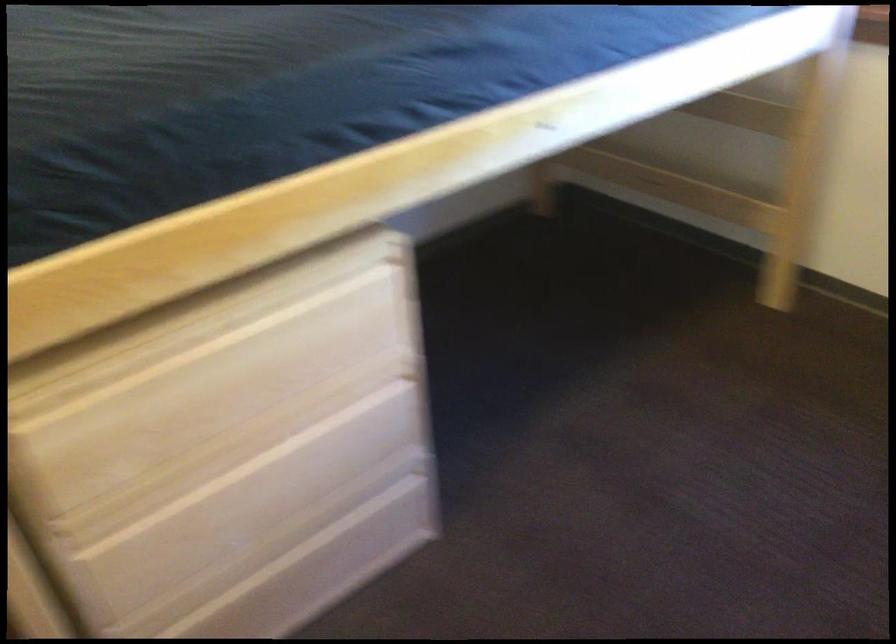
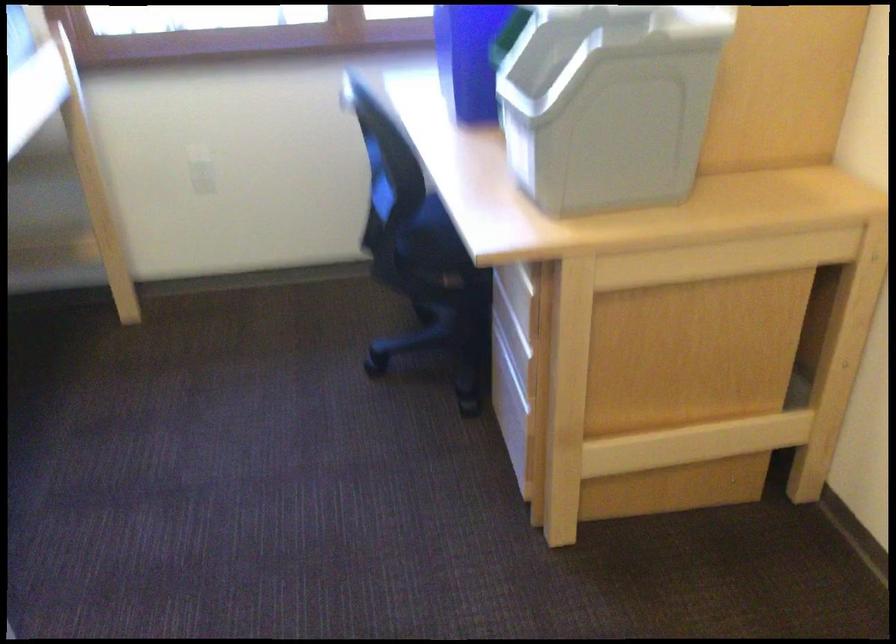
Question: The camera is either moving clockwise (left) or counter-clockwise (right) around the object. The first image is from the beginning of the video and the second image is from the end. Is the camera moving left or right when shooting the video?

Choices:
 (A) Left
 (B) Right

Answer: (A)